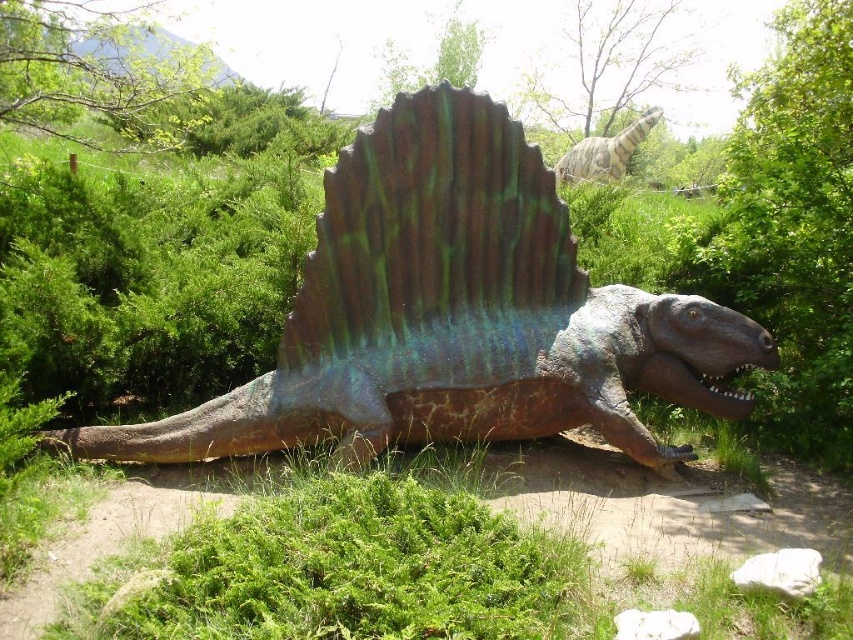
Question: Is shiny metallic dinosaur at center to the left of shiny metallic dinosaur at upper center from the viewer's perspective?

Choices:
 (A) yes
 (B) no

Answer: (A)

Question: Among these objects, which one is farthest from the camera?

Choices:
 (A) shiny metallic dinosaur at upper center
 (B) shiny metallic dinosaur at center

Answer: (A)

Question: Which object appears farthest from the camera in this image?

Choices:
 (A) shiny metallic dinosaur at center
 (B) shiny metallic dinosaur at upper center

Answer: (B)

Question: From the image, what is the correct spatial relationship of shiny metallic dinosaur at center in relation to shiny metallic dinosaur at upper center?

Choices:
 (A) below
 (B) above

Answer: (A)

Question: Does shiny metallic dinosaur at center have a smaller size compared to shiny metallic dinosaur at upper center?

Choices:
 (A) yes
 (B) no

Answer: (B)